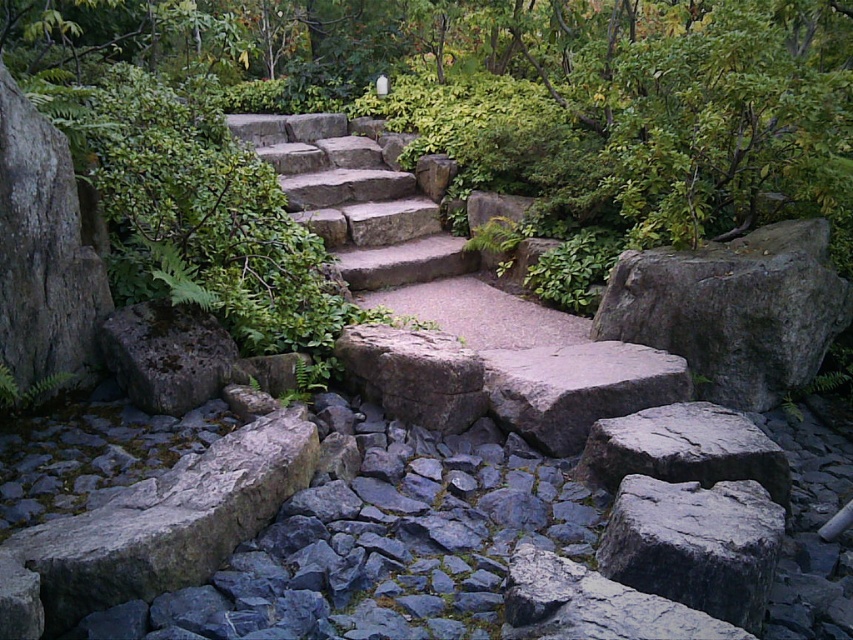
Looking at this image, can you confirm if natural stone stairs at center is smaller than gray rough rock at center-right?

Actually, natural stone stairs at center might be larger than gray rough rock at center-right.

Can you confirm if natural stone stairs at center is positioned below gray rough rock at center-right?

Actually, natural stone stairs at center is above gray rough rock at center-right.

Locate an element on the screen. The width and height of the screenshot is (853, 640). natural stone stairs at center is located at coordinates (454, 285).

What are the coordinates of `natural stone stairs at center` in the screenshot? It's located at (454, 285).

Is gray rough rock at center-right in front of gray rough rock at lower right?

No, gray rough rock at center-right is further to the viewer.

Between point (753, 304) and point (730, 506), which one is positioned in front?

Positioned in front is point (730, 506).

Find the location of a particular element. This screenshot has width=853, height=640. gray rough rock at center-right is located at coordinates 733,308.

Does natural stone stairs at center have a greater height compared to gray rough rock at lower right?

Correct, natural stone stairs at center is much taller as gray rough rock at lower right.

Between natural stone stairs at center and gray rough rock at lower right, which one is positioned lower?

gray rough rock at lower right is lower down.

The image size is (853, 640). What do you see at coordinates (454, 285) in the screenshot? I see `natural stone stairs at center` at bounding box center [454, 285].

Locate an element on the screen. The width and height of the screenshot is (853, 640). natural stone stairs at center is located at coordinates (454, 285).